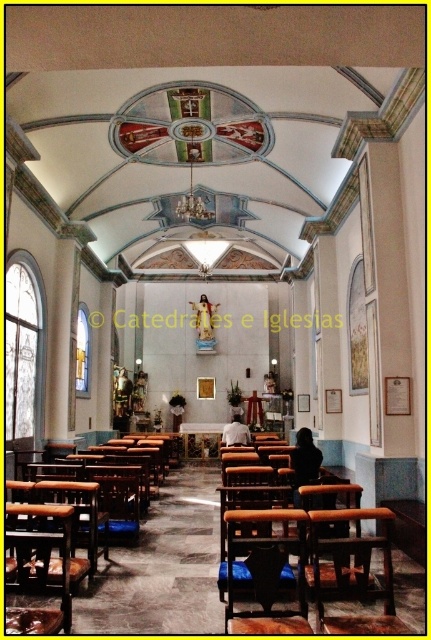
Is wooden polished chair at center below gold textured statue at center?

No.

Between point (227, 620) and point (114, 385), which one is positioned in front?

Point (227, 620) is more forward.

Does point (252, 614) come farther from viewer compared to point (121, 408)?

No, (252, 614) is closer to viewer.

Where is `wooden polished chair at center`? The image size is (431, 640). wooden polished chair at center is located at coordinates (265, 570).

Which is above, wooden table at center or white fabric shirt at center?

white fabric shirt at center is above.

Who is positioned more to the left, wooden table at center or white fabric shirt at center?

wooden table at center

Is point (206, 440) behind point (246, 442)?

Yes, it is behind point (246, 442).

The width and height of the screenshot is (431, 640). I want to click on wooden table at center, so click(x=200, y=440).

Does point (364, 545) come in front of point (127, 515)?

Yes, it is.

Who is positioned more to the right, brown wooden chair at lower center or blue fabric cushion at center?

brown wooden chair at lower center is more to the right.

Which is behind, point (328, 566) or point (137, 536)?

The point (137, 536) is more distant.

Identify the location of brown wooden chair at lower center. The width and height of the screenshot is (431, 640). (350, 570).